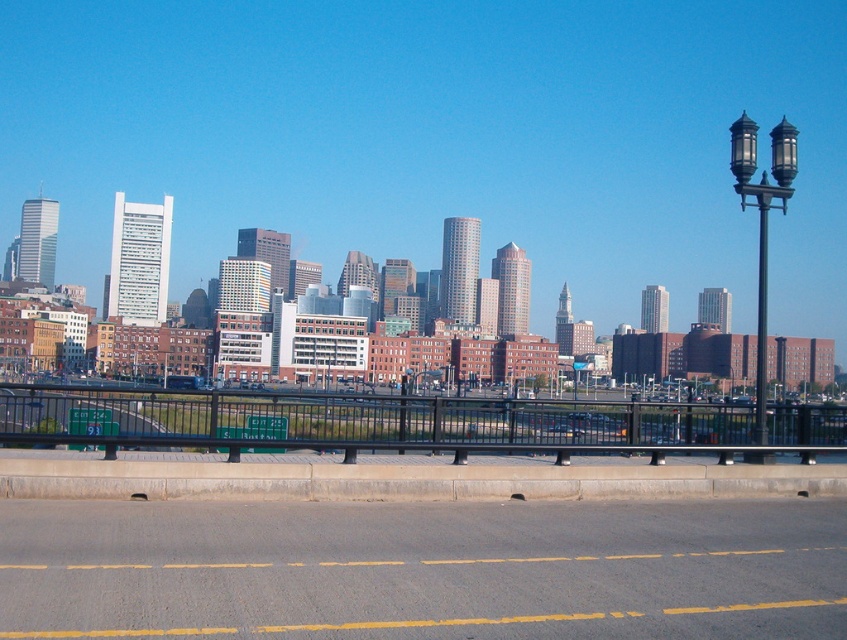
What do you see at coordinates (402, 422) in the screenshot?
I see `black metal fence at lower center` at bounding box center [402, 422].

Can you confirm if black metal fence at lower center is positioned to the right of black metal lamp post at right?

No, black metal fence at lower center is not to the right of black metal lamp post at right.

What do you see at coordinates (402, 422) in the screenshot?
I see `black metal fence at lower center` at bounding box center [402, 422].

The image size is (847, 640). Find the location of `black metal fence at lower center`. black metal fence at lower center is located at coordinates (402, 422).

Does yellow asphalt road at lower center have a greater height compared to black metal fence at lower center?

In fact, yellow asphalt road at lower center may be shorter than black metal fence at lower center.

Which is more to the right, yellow asphalt road at lower center or black metal fence at lower center?

yellow asphalt road at lower center is more to the right.

Identify the location of yellow asphalt road at lower center. This screenshot has height=640, width=847. (424, 570).

Where is `yellow asphalt road at lower center`? The image size is (847, 640). yellow asphalt road at lower center is located at coordinates (424, 570).

Looking at this image, is yellow asphalt road at lower center in front of black metal lamp post at right?

Yes, yellow asphalt road at lower center is in front of black metal lamp post at right.

Is point (197, 545) farther from camera compared to point (785, 161)?

No, (197, 545) is in front of (785, 161).

At what (x,y) coordinates should I click in order to perform the action: click on yellow asphalt road at lower center. Please return your answer as a coordinate pair (x, y). Looking at the image, I should click on (424, 570).